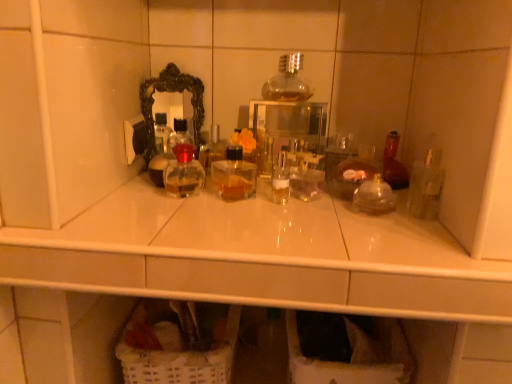
Question: From a real-world perspective, is white wicker laundry basket at lower center located higher than transparent glass medicine cabinet at center?

Choices:
 (A) yes
 (B) no

Answer: (B)

Question: Considering the relative sizes of white wicker laundry basket at lower center and transparent glass medicine cabinet at center in the image provided, is white wicker laundry basket at lower center thinner than transparent glass medicine cabinet at center?

Choices:
 (A) no
 (B) yes

Answer: (A)

Question: Is white wicker laundry basket at lower center positioned beyond the bounds of transparent glass medicine cabinet at center?

Choices:
 (A) no
 (B) yes

Answer: (B)

Question: Is white wicker laundry basket at lower center shorter than transparent glass medicine cabinet at center?

Choices:
 (A) yes
 (B) no

Answer: (A)

Question: Is transparent glass medicine cabinet at center a part of white wicker laundry basket at lower center?

Choices:
 (A) no
 (B) yes

Answer: (A)

Question: Is white wicker laundry basket at lower center taller or shorter than black ornate mirror at upper center?

Choices:
 (A) tall
 (B) short

Answer: (B)

Question: Considering their positions, is white wicker laundry basket at lower center located in front of or behind black ornate mirror at upper center?

Choices:
 (A) front
 (B) behind

Answer: (A)

Question: From the image's perspective, is white wicker laundry basket at lower center located above or below black ornate mirror at upper center?

Choices:
 (A) below
 (B) above

Answer: (A)

Question: Is white wicker laundry basket at lower center wider or thinner than black ornate mirror at upper center?

Choices:
 (A) wide
 (B) thin

Answer: (A)

Question: Considering the relative positions of transparent glass medicine cabinet at center and clear glass bottle at center in the image provided, is transparent glass medicine cabinet at center to the left or to the right of clear glass bottle at center?

Choices:
 (A) left
 (B) right

Answer: (B)

Question: From a real-world perspective, is transparent glass medicine cabinet at center physically located above or below clear glass bottle at center?

Choices:
 (A) above
 (B) below

Answer: (A)

Question: Is transparent glass medicine cabinet at center inside the boundaries of clear glass bottle at center, or outside?

Choices:
 (A) outside
 (B) inside

Answer: (A)

Question: Is point (285, 127) closer or farther from the camera than point (166, 155)?

Choices:
 (A) closer
 (B) farther

Answer: (B)

Question: Is black ornate mirror at upper center bigger or smaller than clear glass bottle at center?

Choices:
 (A) small
 (B) big

Answer: (B)

Question: Does point [147, 119] appear closer or farther from the camera than point [150, 175]?

Choices:
 (A) closer
 (B) farther

Answer: (B)